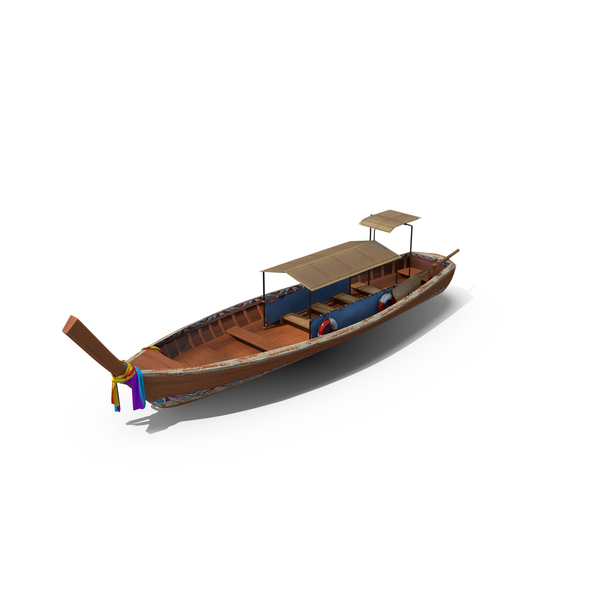
This screenshot has height=600, width=600. In order to click on canopy in this screenshot , I will do [345, 270], [327, 253].